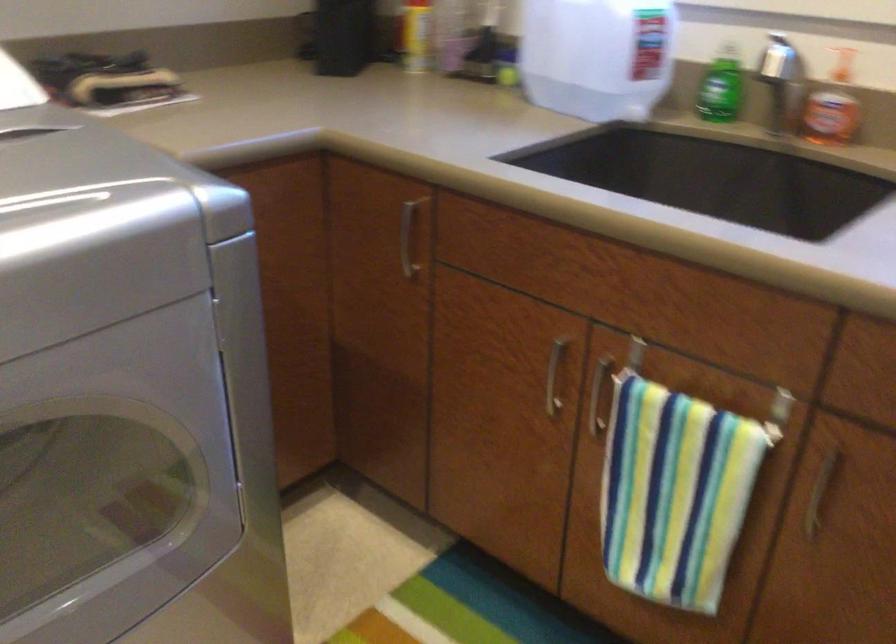
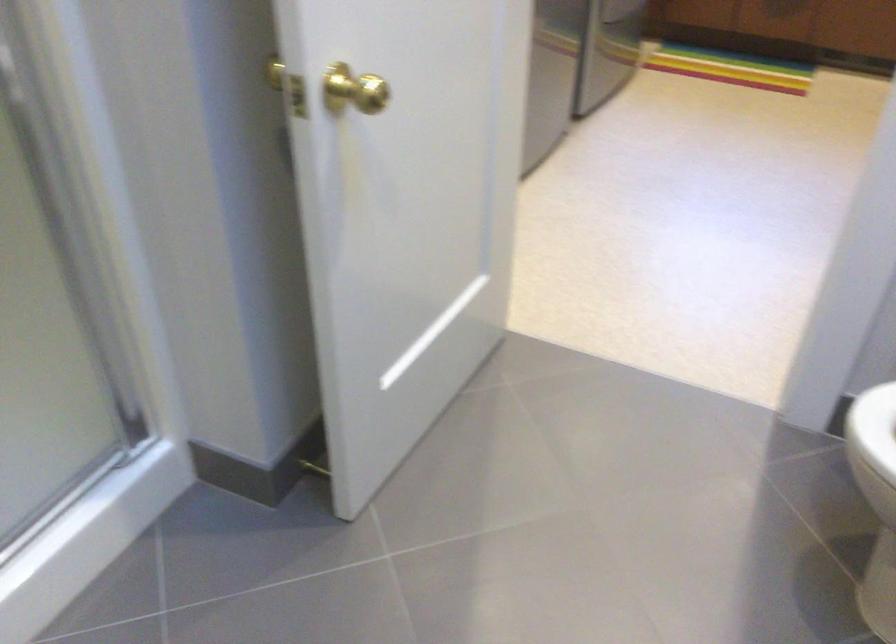
In a continuous first-person perspective shot, in which direction is the camera moving?

The movement direction of the cameraman is left, backward.